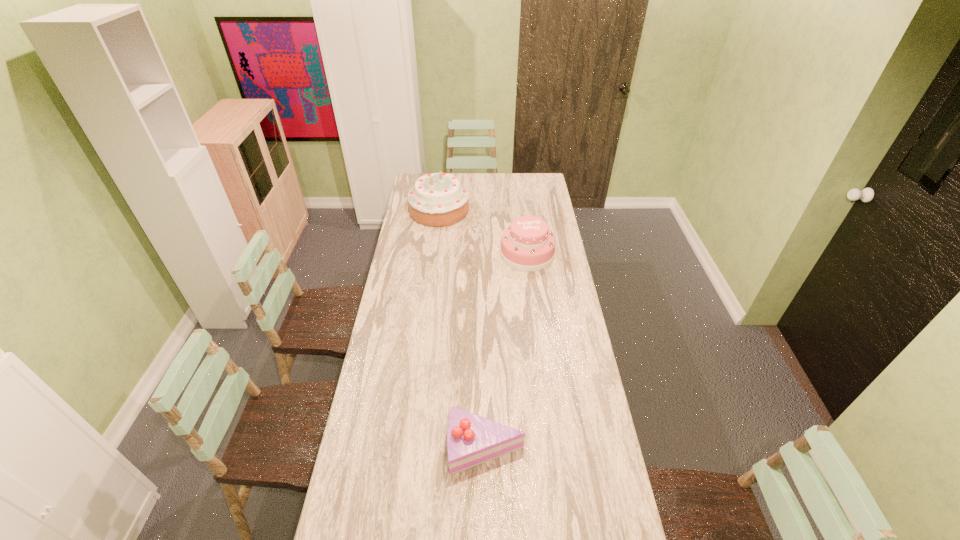
Image resolution: width=960 pixels, height=540 pixels. Identify the location of object positioned at the right edge. (527, 245).

This screenshot has height=540, width=960. What are the coordinates of `blank space at the far edge of the desktop` in the screenshot? It's located at (510, 175).

In the image, there is a desktop. Where is `free space at the left edge`? free space at the left edge is located at coordinates (406, 259).

This screenshot has width=960, height=540. In order to click on free location at the right edge of the desktop in this screenshot , I will do `click(580, 345)`.

Where is `blank space at the far right corner of the desktop`? blank space at the far right corner of the desktop is located at coordinates (545, 191).

Locate an element on the screen. free area in between the second tallest cake and the shortest object is located at coordinates (507, 351).

Where is `the second closest object to the second farthest cake`? the second closest object to the second farthest cake is located at coordinates (472, 440).

In order to click on object that is the second closest to the nearest cake in this screenshot , I will do 439,199.

The height and width of the screenshot is (540, 960). I want to click on the closest cake to the tallest object, so click(x=527, y=245).

Select which cake is the second closest to the farthest cake. Please provide its 2D coordinates. Your answer should be formatted as a tuple, i.e. [(x, y)], where the tuple contains the x and y coordinates of a point satisfying the conditions above.

[(472, 440)]